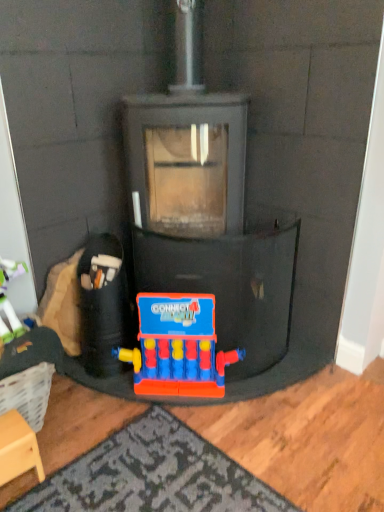
At what (x,y) coordinates should I click in order to perform the action: click on free spot to the right of wooden stool at lower left. Please return your answer as a coordinate pair (x, y). Image resolution: width=384 pixels, height=512 pixels. Looking at the image, I should click on (76, 473).